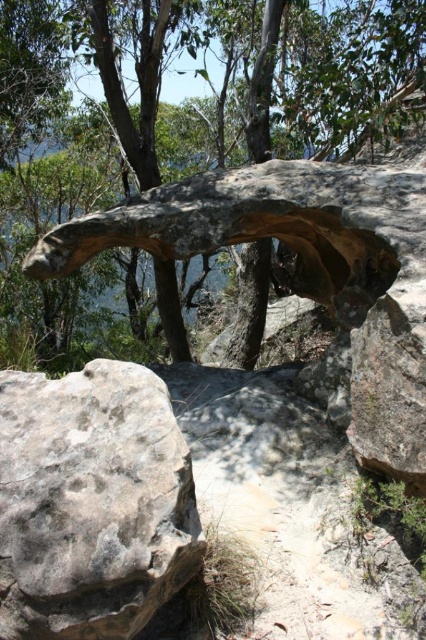
Is point (14, 584) farther from viewer compared to point (244, 342)?

No, it is in front of (244, 342).

Which is behind, point (83, 515) or point (255, 269)?

Point (255, 269)

Which is behind, point (189, 538) or point (265, 269)?

Point (265, 269)

Find the location of a particular element. The width and height of the screenshot is (426, 640). gray rough rock at lower left is located at coordinates (92, 502).

Measure the distance between brown rough rock at center and gray rough rock at lower left.

brown rough rock at center is 4.52 meters away from gray rough rock at lower left.

This screenshot has height=640, width=426. I want to click on brown rough rock at center, so click(x=339, y=74).

Is point (334, 76) positioned after point (92, 540)?

Yes, it is behind point (92, 540).

This screenshot has width=426, height=640. Find the location of `brown rough rock at center`. brown rough rock at center is located at coordinates (339, 74).

Who is shorter, brown rough rock at center or brown rough tree trunk at center?

With less height is brown rough tree trunk at center.

Can you confirm if brown rough rock at center is positioned above brown rough tree trunk at center?

Correct, brown rough rock at center is located above brown rough tree trunk at center.

Between point (157, 28) and point (259, 333), which one is positioned behind?

The point (259, 333) is more distant.

You are a GUI agent. You are given a task and a screenshot of the screen. Output one action in this format:
    pyautogui.click(x=<x>, y=<y>)
    Task: Click on the brown rough rock at center
    The image size is (426, 640).
    Given the screenshot: What is the action you would take?
    pyautogui.click(x=339, y=74)